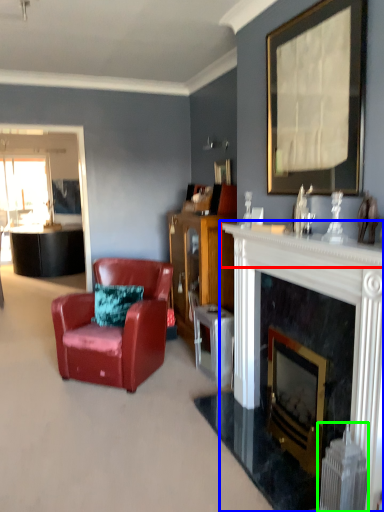
Question: Which object is positioned closest to mantle (highlighted by a red box)? Select from fireplace (highlighted by a blue box) and radiator (highlighted by a green box).

Choices:
 (A) fireplace
 (B) radiator

Answer: (A)